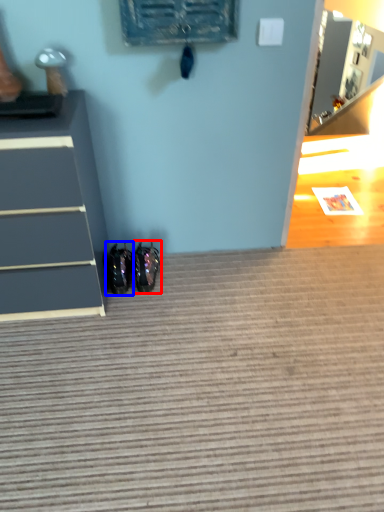
Question: Which object appears farthest to the camera in this image, footwear (highlighted by a red box) or footwear (highlighted by a blue box)?

Choices:
 (A) footwear
 (B) footwear

Answer: (A)